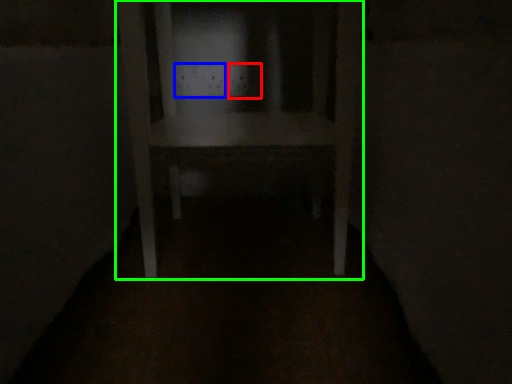
Question: Which object is the closest to the electric outlet (highlighted by a red box)? Choose among these: electric outlet (highlighted by a blue box) or furniture (highlighted by a green box).

Choices:
 (A) electric outlet
 (B) furniture

Answer: (A)